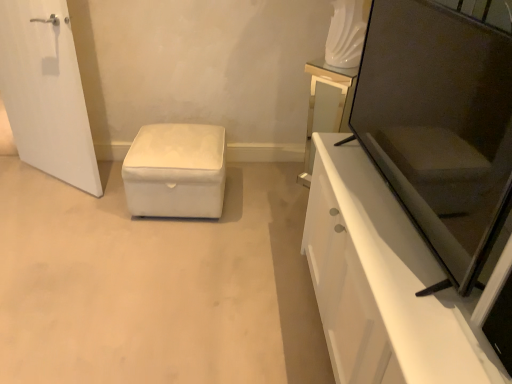
Question: Is there a large distance between matte glass vanity at upper right and white glossy cabinet at right?

Choices:
 (A) no
 (B) yes

Answer: (A)

Question: Can you confirm if matte glass vanity at upper right is shorter than white glossy cabinet at right?

Choices:
 (A) no
 (B) yes

Answer: (B)

Question: Does matte glass vanity at upper right have a lesser width compared to white glossy cabinet at right?

Choices:
 (A) no
 (B) yes

Answer: (B)

Question: From a real-world perspective, is matte glass vanity at upper right beneath white glossy cabinet at right?

Choices:
 (A) no
 (B) yes

Answer: (B)

Question: From the image's perspective, is matte glass vanity at upper right below white glossy cabinet at right?

Choices:
 (A) yes
 (B) no

Answer: (B)

Question: Is matte glass vanity at upper right looking in the opposite direction of white glossy cabinet at right?

Choices:
 (A) no
 (B) yes

Answer: (A)

Question: Is matte black screen door at right turned away from white glossy cabinet at right?

Choices:
 (A) yes
 (B) no

Answer: (A)

Question: Does matte black screen door at right have a lesser height compared to white glossy cabinet at right?

Choices:
 (A) yes
 (B) no

Answer: (A)

Question: Is matte black screen door at right further to camera compared to white glossy cabinet at right?

Choices:
 (A) no
 (B) yes

Answer: (B)

Question: From a real-world perspective, is matte black screen door at right on top of white glossy cabinet at right?

Choices:
 (A) no
 (B) yes

Answer: (B)

Question: Can you confirm if matte black screen door at right is positioned to the right of white glossy cabinet at right?

Choices:
 (A) no
 (B) yes

Answer: (A)

Question: From the image's perspective, is matte black screen door at right beneath white glossy cabinet at right?

Choices:
 (A) no
 (B) yes

Answer: (A)

Question: From a real-world perspective, is white glossy cabinet at right under white fabric ottoman at center?

Choices:
 (A) yes
 (B) no

Answer: (B)